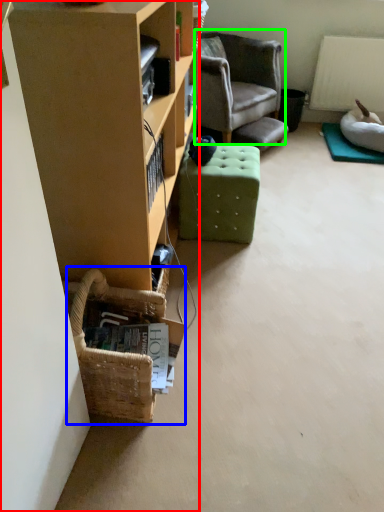
Question: Which object is positioned farthest from cabinetry (highlighted by a red box)? Select from basket (highlighted by a blue box) and chair (highlighted by a green box).

Choices:
 (A) basket
 (B) chair

Answer: (B)